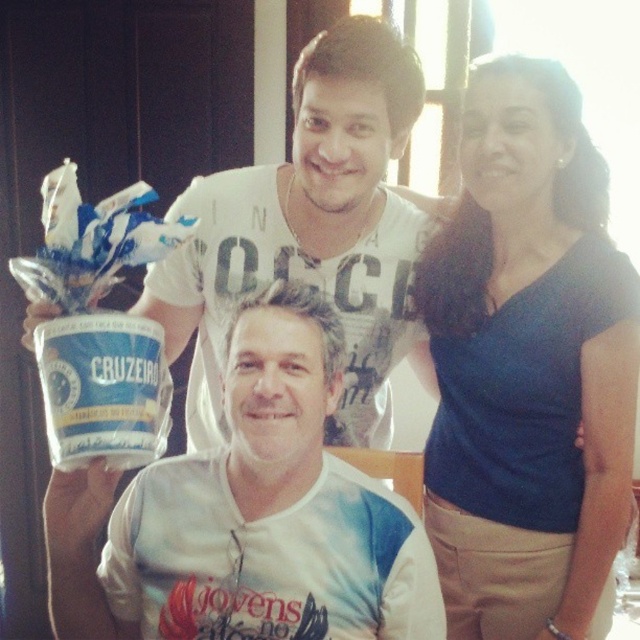
Does white printed t-shirt at center lie in front of white matte yogurt at center?

No, it is behind white matte yogurt at center.

What do you see at coordinates (248, 515) in the screenshot? Image resolution: width=640 pixels, height=640 pixels. I see `white printed t-shirt at center` at bounding box center [248, 515].

Find the location of a particular element. Image resolution: width=640 pixels, height=640 pixels. white printed t-shirt at center is located at coordinates (248, 515).

Is blue cotton shirt at upper right below white printed t-shirt at center?

Actually, blue cotton shirt at upper right is above white printed t-shirt at center.

Is blue cotton shirt at upper right further to the viewer compared to white printed t-shirt at center?

Yes, blue cotton shirt at upper right is further from the viewer.

Measure the distance between point (628,435) and camera.

Point (628,435) is 1.29 meters away from camera.

This screenshot has width=640, height=640. I want to click on blue cotton shirt at upper right, so click(x=529, y=365).

Does blue cotton shirt at upper right come in front of white matte yogurt at center?

No, blue cotton shirt at upper right is further to the viewer.

Who is taller, blue cotton shirt at upper right or white matte yogurt at center?

blue cotton shirt at upper right

Image resolution: width=640 pixels, height=640 pixels. I want to click on blue cotton shirt at upper right, so click(529, 365).